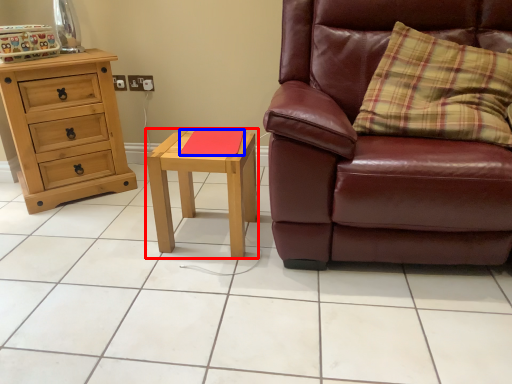
Question: Which object is further to the camera taking this photo, nightstand (highlighted by a red box) or pad (highlighted by a blue box)?

Choices:
 (A) nightstand
 (B) pad

Answer: (B)